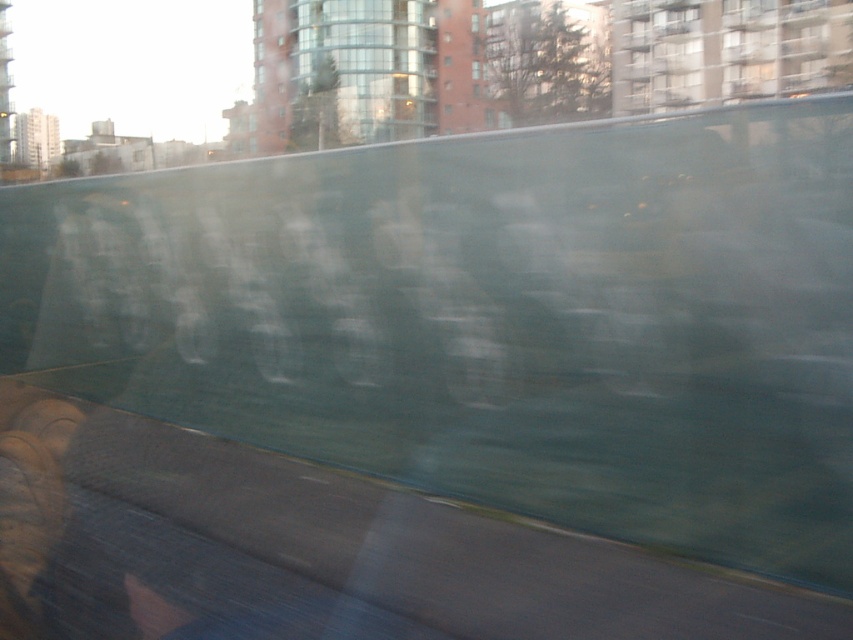
You are a passenger on a moving vehicle and you want to look outside. Which window should you choose between the transparent glass window at upper center and the transparent glass window at center if you want a wider view?

The transparent glass window at upper center is larger in size than the transparent glass window at center, so you should choose the transparent glass window at upper center for a wider view.

You are sitting on the seat inside the vehicle and want to look outside through the transparent glass window at upper center. Where should you look to see the large dark green wall outside?

You should look at the transparent glass window at upper center located at point coordinates (474, 22) to see the large dark green wall outside.